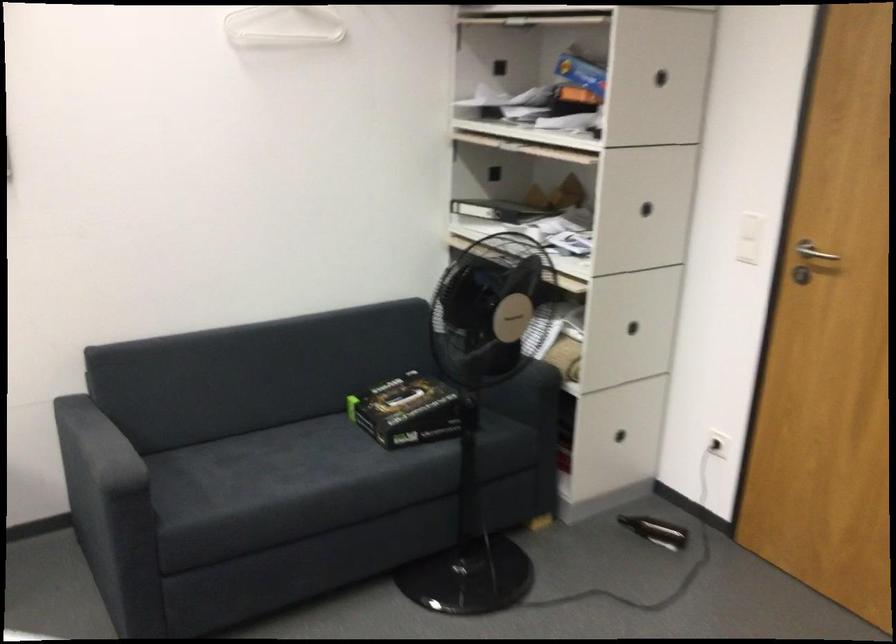
This screenshot has height=644, width=896. What do you see at coordinates (813, 252) in the screenshot? I see `the silver door handle` at bounding box center [813, 252].